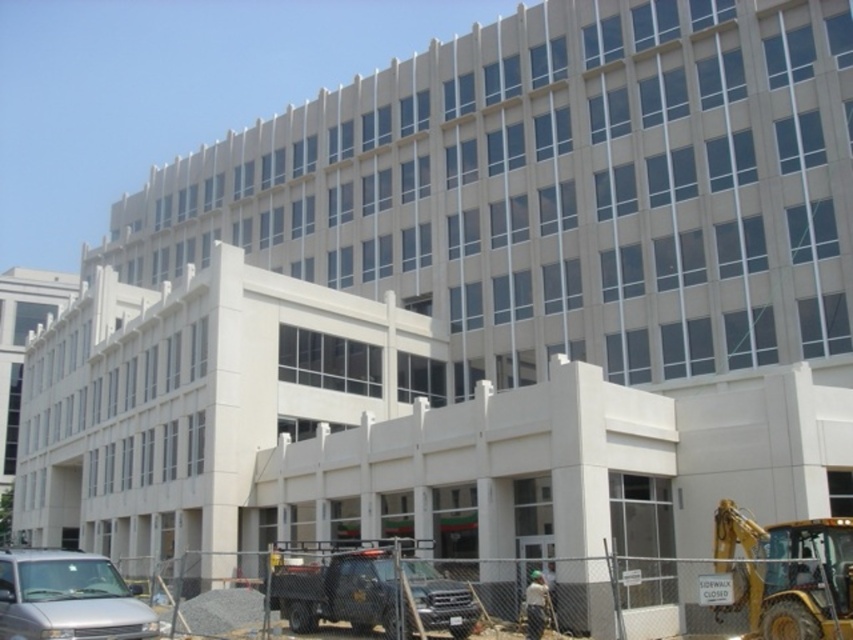
Is point (279, 586) farther from camera compared to point (537, 592)?

Yes, point (279, 586) is behind point (537, 592).

Measure the distance between point (450,595) and camera.

37.56 meters

Which is behind, point (347, 588) or point (525, 636)?

The point (525, 636) is more distant.

Locate an element on the screen. The image size is (853, 640). matte black truck at lower center is located at coordinates (340, 592).

Does yellow metallic excavator at lower right have a larger size compared to silver metallic van at lower left?

No.

Is yellow metallic excavator at lower right to the left of silver metallic van at lower left from the viewer's perspective?

Incorrect, yellow metallic excavator at lower right is not on the left side of silver metallic van at lower left.

Image resolution: width=853 pixels, height=640 pixels. What do you see at coordinates (787, 573) in the screenshot?
I see `yellow metallic excavator at lower right` at bounding box center [787, 573].

Where is `yellow metallic excavator at lower right`? yellow metallic excavator at lower right is located at coordinates (787, 573).

Is yellow metallic excavator at lower right to the right of matte black truck at lower center from the viewer's perspective?

Yes, yellow metallic excavator at lower right is to the right of matte black truck at lower center.

Locate an element on the screen. yellow metallic excavator at lower right is located at coordinates (787, 573).

Is point (726, 572) behind point (364, 595)?

No, (726, 572) is closer to viewer.

The image size is (853, 640). Find the location of `yellow metallic excavator at lower right`. yellow metallic excavator at lower right is located at coordinates (787, 573).